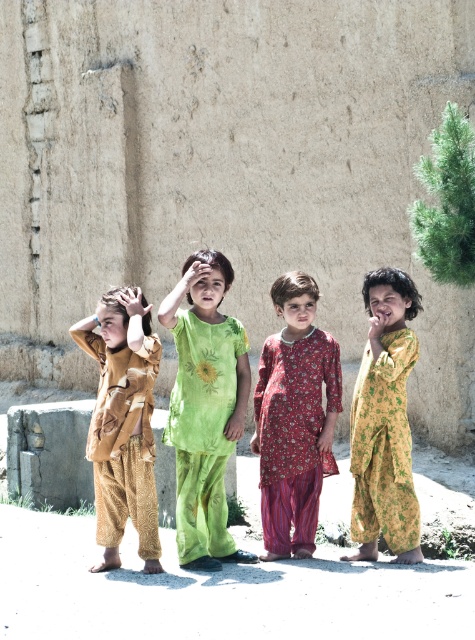
Question: Can you confirm if matte brown outfit at left is positioned to the left of floral printed dress at center?

Choices:
 (A) yes
 (B) no

Answer: (A)

Question: In this image, where is floral printed dress at center located relative to smooth skin hand at center?

Choices:
 (A) right
 (B) left

Answer: (B)

Question: Which point is closer to the camera?

Choices:
 (A) yellow floral dress at right
 (B) matte green hand at center
 (C) smooth skin hand at center

Answer: (A)

Question: Is floral printed dress at center below smooth skin hand at center?

Choices:
 (A) no
 (B) yes

Answer: (B)

Question: Which of these objects is positioned closest to the smooth skin hand at center?

Choices:
 (A) floral printed dress at center
 (B) matte green hand at center
 (C) matte brown outfit at left

Answer: (A)

Question: Which object is farther from the camera taking this photo?

Choices:
 (A) yellow floral dress at right
 (B) matte green hand at center
 (C) floral printed dress at center
 (D) smooth skin hand at center

Answer: (B)